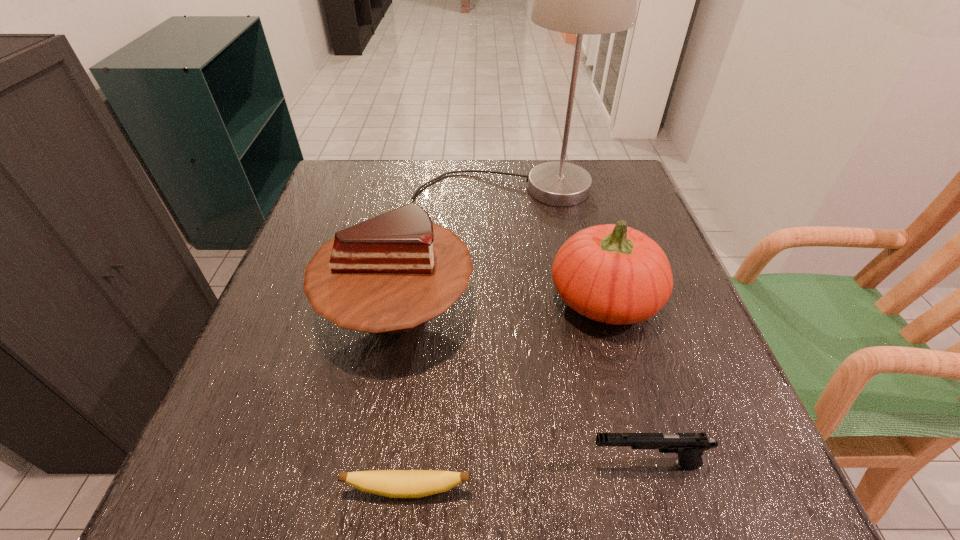
Identify the location of free space at the far right corner. This screenshot has width=960, height=540. (607, 204).

Image resolution: width=960 pixels, height=540 pixels. I want to click on empty space between the nearest object and the pumpkin, so click(506, 394).

Locate an element on the screen. vacant area between the cake and the fourth farthest object is located at coordinates 521,387.

I want to click on free area in between the gun and the pumpkin, so click(625, 381).

This screenshot has height=540, width=960. Find the location of `blank region between the gun and the tallest object`. blank region between the gun and the tallest object is located at coordinates (x=576, y=326).

Find the location of `vacant space in between the pumpkin and the farthest object`. vacant space in between the pumpkin and the farthest object is located at coordinates (555, 244).

You are a GUI agent. You are given a task and a screenshot of the screen. Output one action in this format:
    pyautogui.click(x=<x>, y=<y>)
    Task: Click on the free space between the banana and the pumpkin
    
    Given the screenshot: What is the action you would take?
    pyautogui.click(x=506, y=394)

Find the location of a particular element. The image size is (960, 540). free space between the shortest object and the pumpkin is located at coordinates (506, 394).

Identify the location of vacant area that lies between the pumpkin and the table lamp. The width and height of the screenshot is (960, 540). (555, 244).

The width and height of the screenshot is (960, 540). In order to click on free space between the table lamp and the banana in this screenshot , I will do `click(457, 339)`.